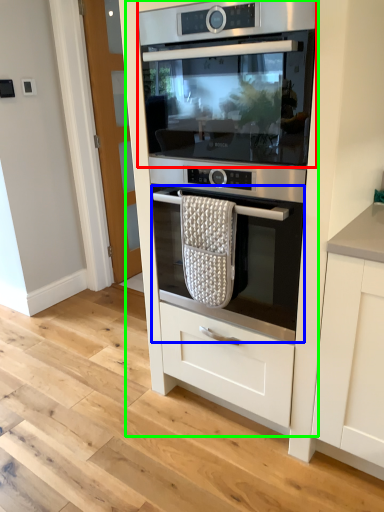
Question: Estimate the real-world distances between objects in this image. Which object is closer to home appliance (highlighted by a red box), oven (highlighted by a blue box) or oven (highlighted by a green box)?

Choices:
 (A) oven
 (B) oven

Answer: (B)